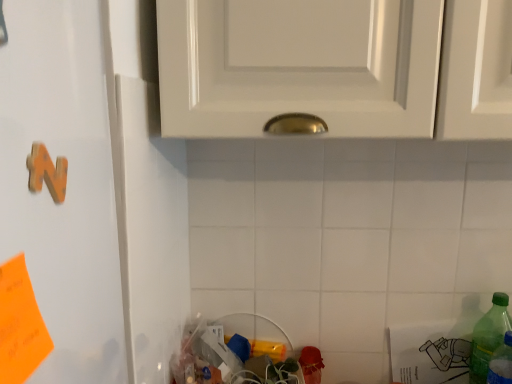
What do you see at coordinates (488, 337) in the screenshot? Image resolution: width=512 pixels, height=384 pixels. I see `green plastic bottle at lower right` at bounding box center [488, 337].

Identify the location of green plastic bottle at lower right. The height and width of the screenshot is (384, 512). (488, 337).

At what (x,y) coordinates should I click in order to perform the action: click on green plastic bottle at lower right. Please return your answer as a coordinate pair (x, y). Looking at the image, I should click on point(488,337).